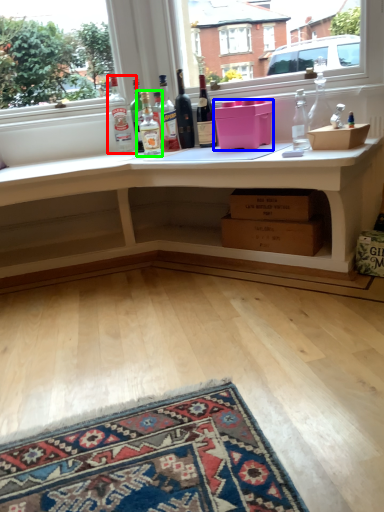
Question: Which is nearer to the bottle (highlighted by a red box)? box (highlighted by a blue box) or bottle (highlighted by a green box).

Choices:
 (A) box
 (B) bottle

Answer: (B)